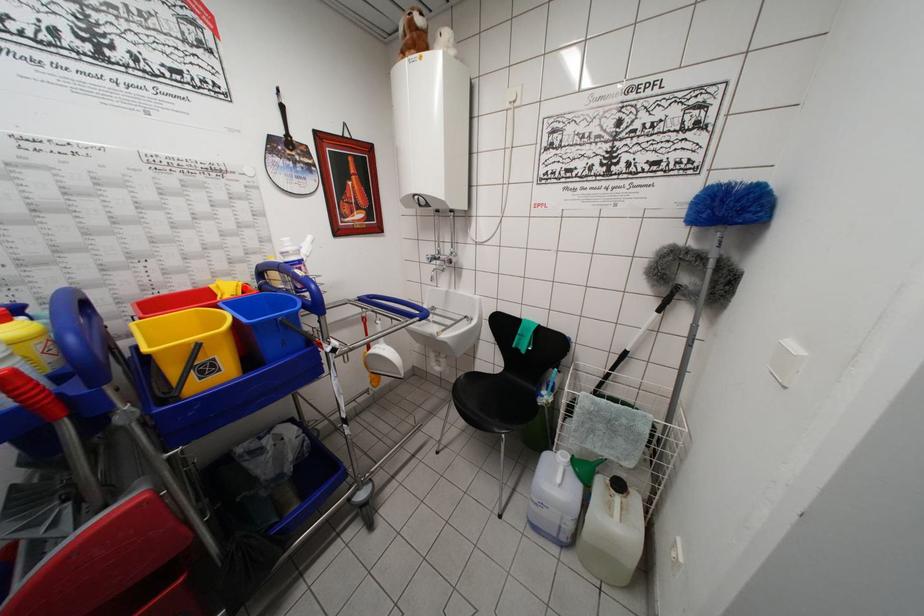
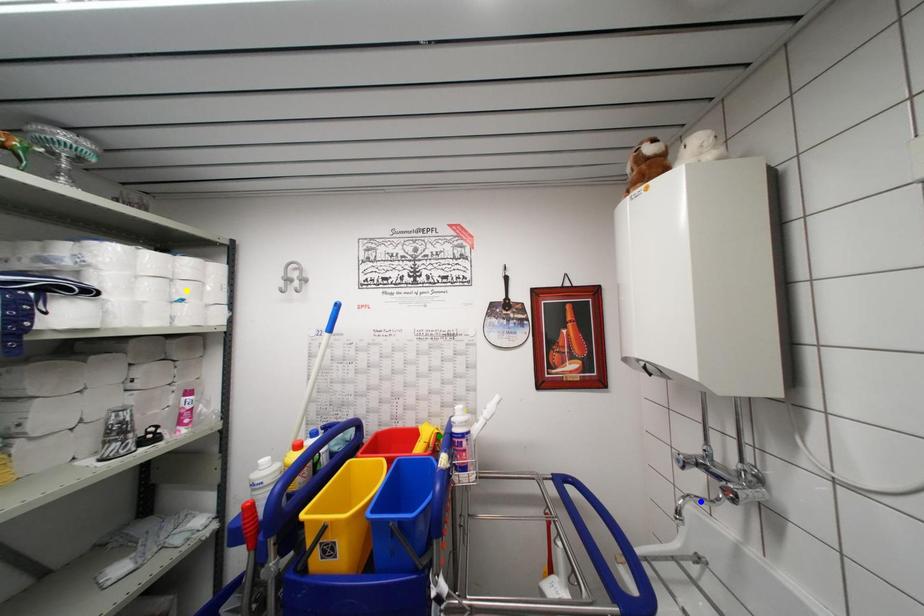
Question: I am providing you with two images of the same scene from different viewpoints. A red point is marked on the first image. You are given multiple points on the second image. Which spot in image 2 lines up with the point in image 1?

Choices:
 (A) yellow point
 (B) green point
 (C) blue point

Answer: (B)